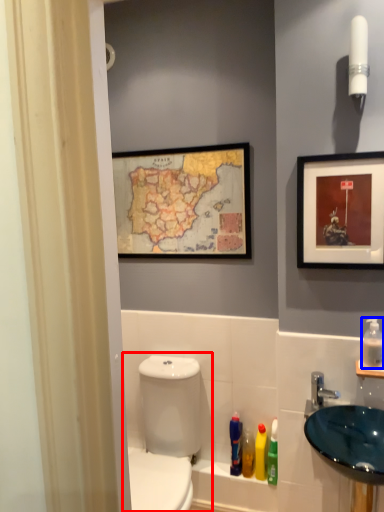
Question: Which object appears closest to the camera in this image, toilet (highlighted by a red box) or mouthwash (highlighted by a blue box)?

Choices:
 (A) toilet
 (B) mouthwash

Answer: (A)